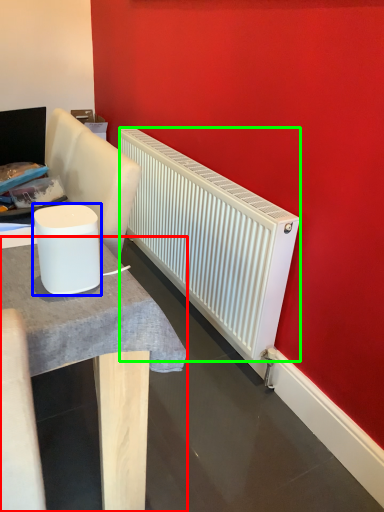
Question: Estimate the real-world distances between objects in this image. Which object is closer to table (highlighted by a red box), appliance (highlighted by a blue box) or radiator (highlighted by a green box)?

Choices:
 (A) appliance
 (B) radiator

Answer: (A)